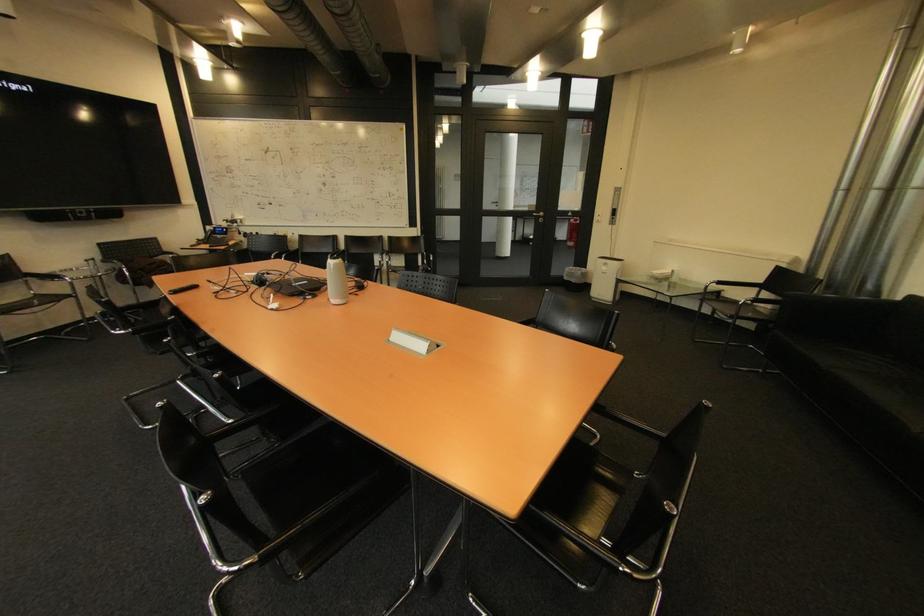
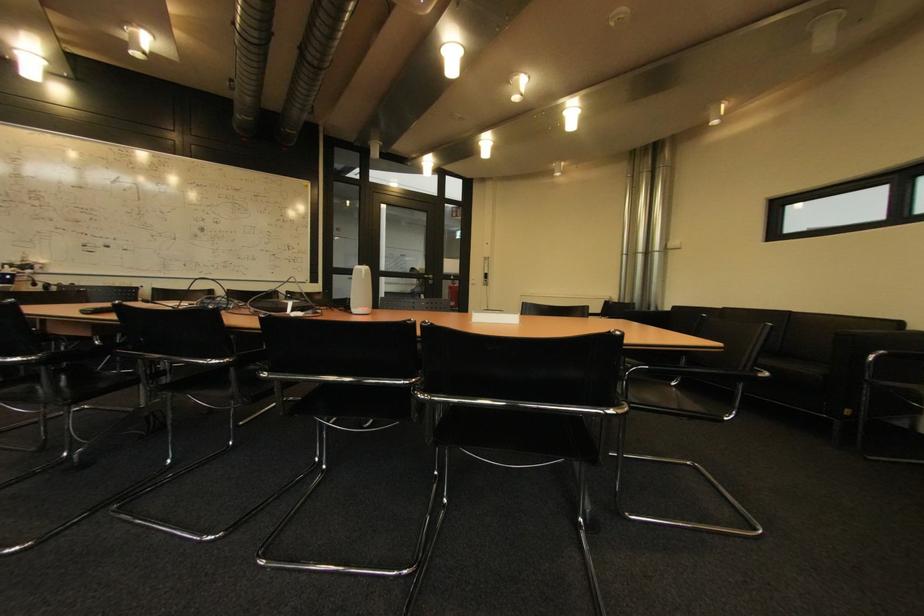
Where in the second image is the point corresponding to pixel 573 215 from the first image?

(456, 278)